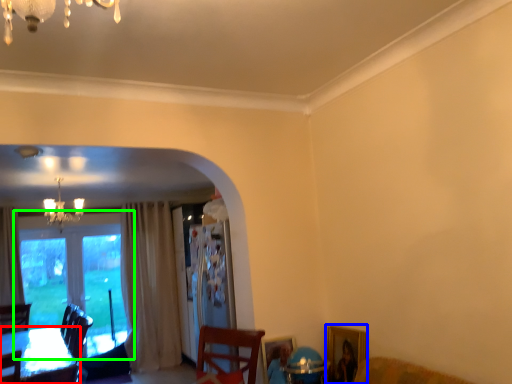
Question: Which object is positioned farthest from table (highlighted by a red box)? Select from picture frame (highlighted by a blue box) and window (highlighted by a green box).

Choices:
 (A) picture frame
 (B) window

Answer: (A)